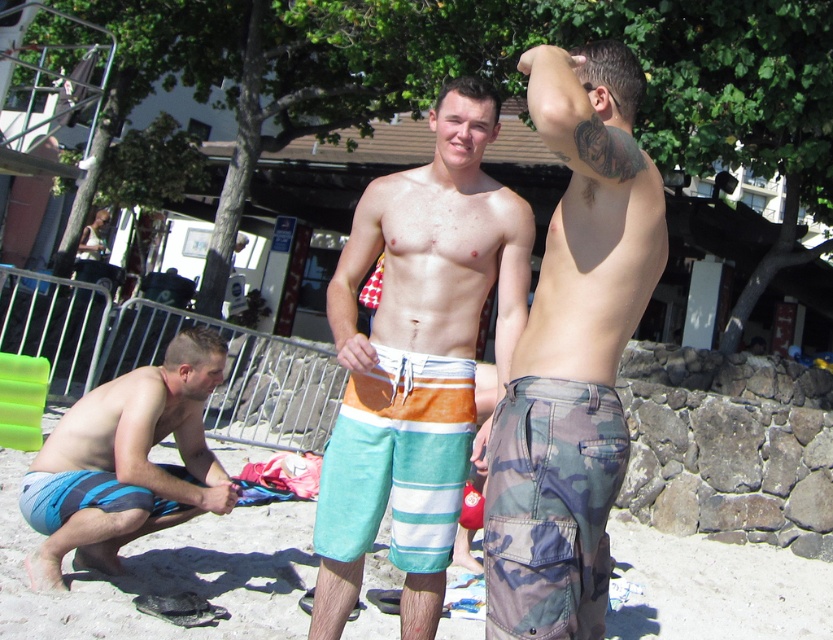
You are a photographer trying to capture the men in the beach scene. You want to ensure that both the blue striped boardshorts at lower left and the striped cotton boardshorts at center are clearly visible in your photo. Since you need to adjust the camera focus based on their heights, which pair of boardshorts should you focus on first to ensure proper depth of field?

The blue striped boardshorts at lower left has a greater height compared to striped cotton boardshorts at center, so you should focus on the blue striped boardshorts at lower left first to ensure proper depth of field.

You are a photographer trying to capture the central figure in the beach scene. You notice two pairs of swim trunks at the center. Which pair is closer to you, the multicolored striped boardshorts at center or the striped cotton boardshorts at center?

The multicolored striped boardshorts at center is closer to the viewer than the striped cotton boardshorts at center.